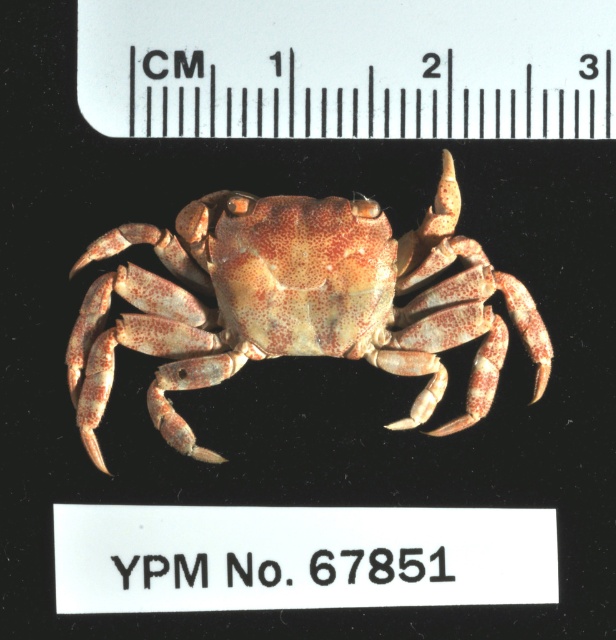
Question: Which point is closer to the camera taking this photo?

Choices:
 (A) (233, 268)
 (B) (285, 60)

Answer: (A)

Question: Does white plastic ruler at upper center have a greater width compared to speckled beige crab at center?

Choices:
 (A) no
 (B) yes

Answer: (B)

Question: Which point is closer to the camera?

Choices:
 (A) white plastic ruler at upper center
 (B) speckled beige crab at center

Answer: (A)

Question: Can you confirm if white plastic ruler at upper center is thinner than speckled beige crab at center?

Choices:
 (A) no
 (B) yes

Answer: (A)

Question: Which point is farther from the camera taking this photo?

Choices:
 (A) click(x=415, y=259)
 (B) click(x=612, y=22)

Answer: (A)

Question: Does white plastic ruler at upper center lie behind speckled beige crab at center?

Choices:
 (A) no
 (B) yes

Answer: (A)